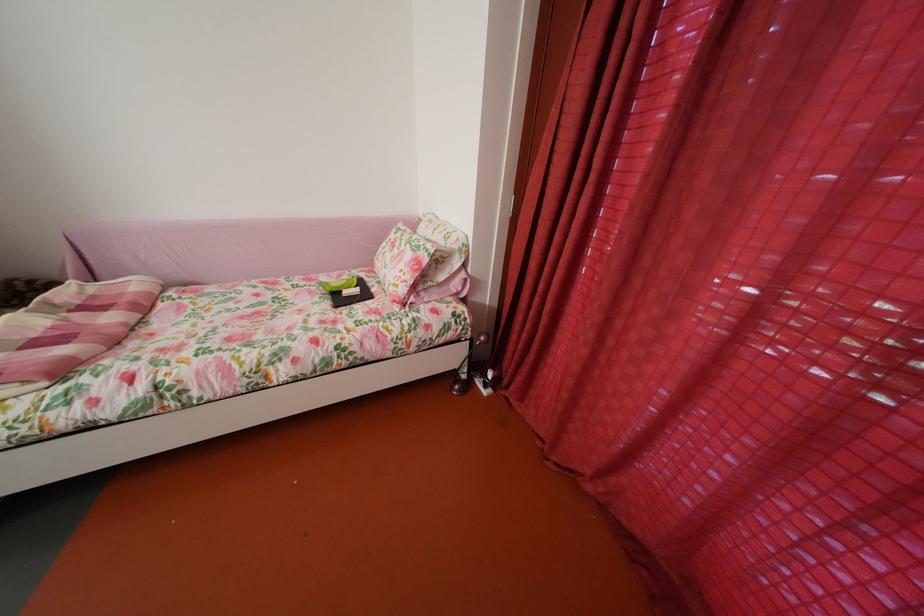
What do you see at coordinates (350, 297) in the screenshot? Image resolution: width=924 pixels, height=616 pixels. I see `a black electronic device` at bounding box center [350, 297].